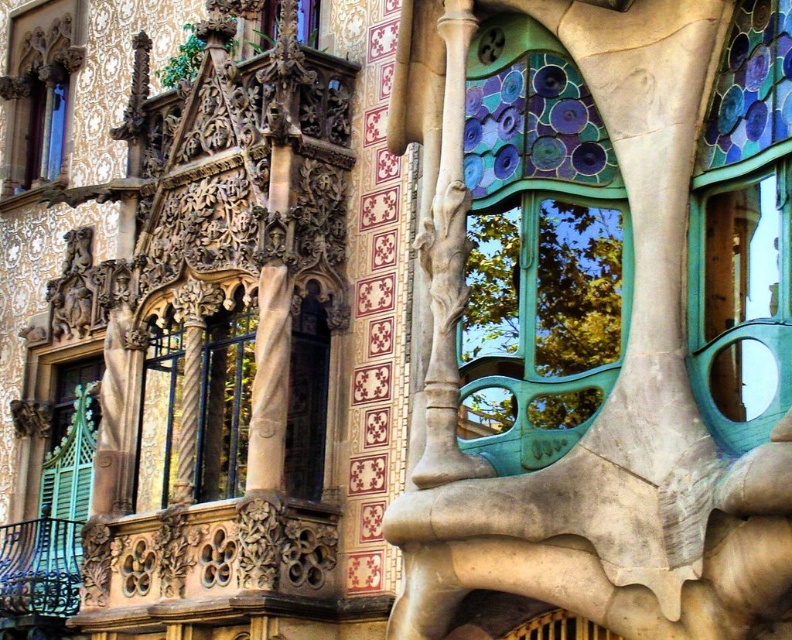
Question: Among these objects, which one is nearest to the camera?

Choices:
 (A) matte stone sculpture at center
 (B) green patina glass at center right

Answer: (A)

Question: Among these objects, which one is farthest from the camera?

Choices:
 (A) matte stone sculpture at center
 (B) teal glass window at center right

Answer: (B)

Question: Considering the real-world distances, which object is farthest from the matte glass window at upper left?

Choices:
 (A) blue wrought iron balcony at lower left
 (B) matte glass window at upper center

Answer: (A)

Question: Does green patina glass at center right lie in front of blue wrought iron balcony at lower left?

Choices:
 (A) no
 (B) yes

Answer: (B)

Question: Does matte glass window at upper left have a smaller size compared to matte glass window at upper center?

Choices:
 (A) no
 (B) yes

Answer: (A)

Question: Does matte stone sculpture at center appear on the left side of matte glass window at upper left?

Choices:
 (A) yes
 (B) no

Answer: (B)